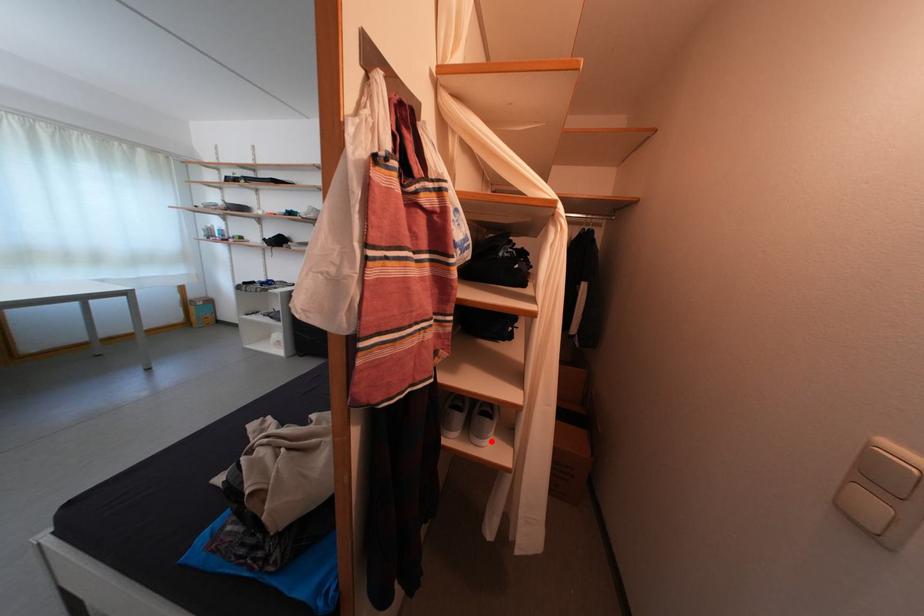
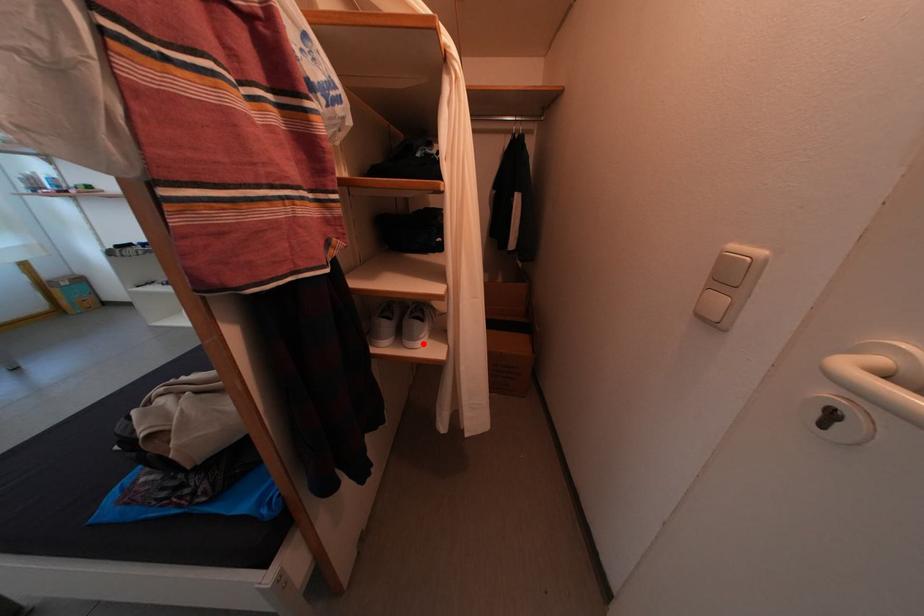
Looking at this image, I am providing you with two images of the same scene from different viewpoints. A red point is marked on the first image and another point is marked on the second image. Is the red point in image1 aligned with the point shown in image2?

Yes